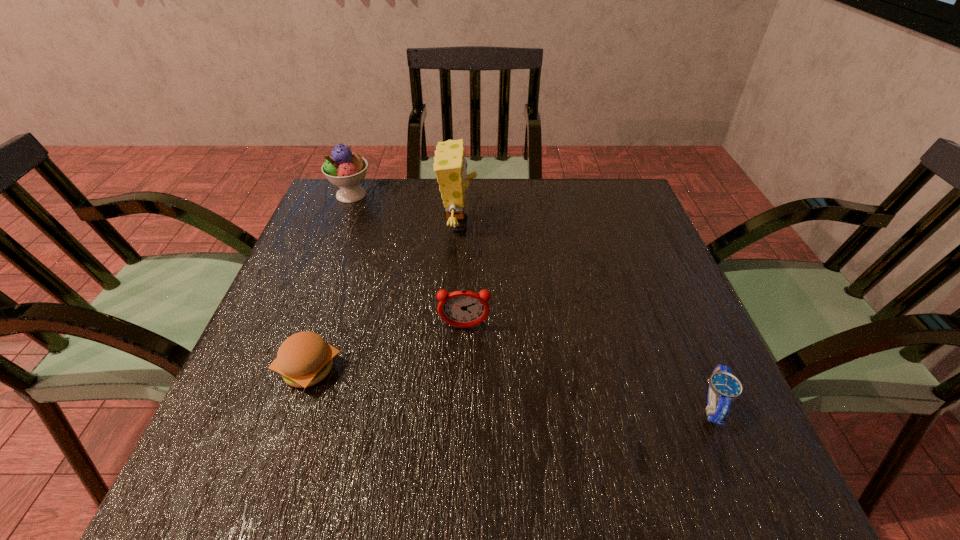
Where is `vacant space in between the third farthest object and the shortest object`? vacant space in between the third farthest object and the shortest object is located at coordinates (588, 366).

Find the location of a particular element. Image resolution: width=960 pixels, height=540 pixels. vacant area that lies between the hamburger and the third shortest object is located at coordinates (387, 348).

Identify the location of vacant point located between the rightmost object and the icecream. (532, 300).

Locate which object ranks second in proximity to the icecream. Please provide its 2D coordinates. Your answer should be formatted as a tuple, i.e. [(x, y)], where the tuple contains the x and y coordinates of a point satisfying the conditions above.

[(462, 308)]

Point out which object is positioned as the third nearest to the hamburger. Please provide its 2D coordinates. Your answer should be formatted as a tuple, i.e. [(x, y)], where the tuple contains the x and y coordinates of a point satisfying the conditions above.

[(344, 169)]

The width and height of the screenshot is (960, 540). What are the coordinates of `vacant space that satisfies the following two spatial constraints: 1. on the face of the watch; 2. on the left side of the tallest object` in the screenshot? It's located at (447, 405).

This screenshot has height=540, width=960. I want to click on free space that satisfies the following two spatial constraints: 1. on the front side of the shortest object; 2. on the left side of the icecream, so click(269, 405).